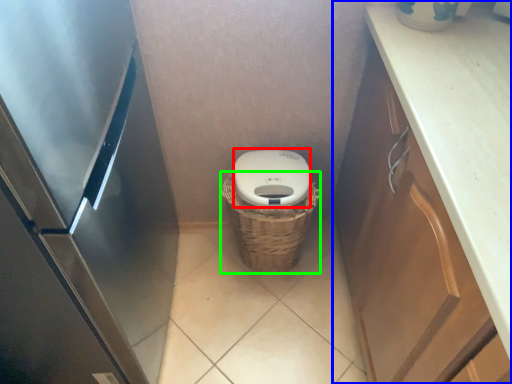
Question: Estimate the real-world distances between objects in this image. Which object is farther from lid (highlighted by a red box), cabinetry (highlighted by a blue box) or basket (highlighted by a green box)?

Choices:
 (A) cabinetry
 (B) basket

Answer: (A)